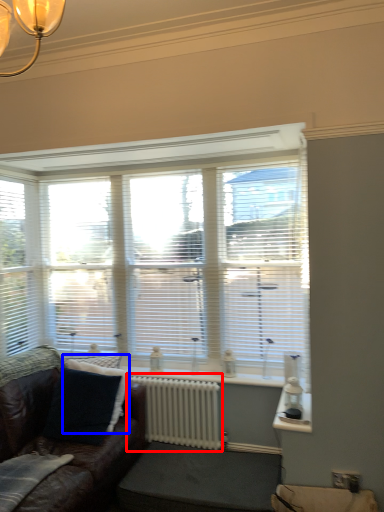
Question: Among these objects, which one is nearest to the camera, radiator (highlighted by a red box) or pillow (highlighted by a blue box)?

Choices:
 (A) radiator
 (B) pillow

Answer: (B)